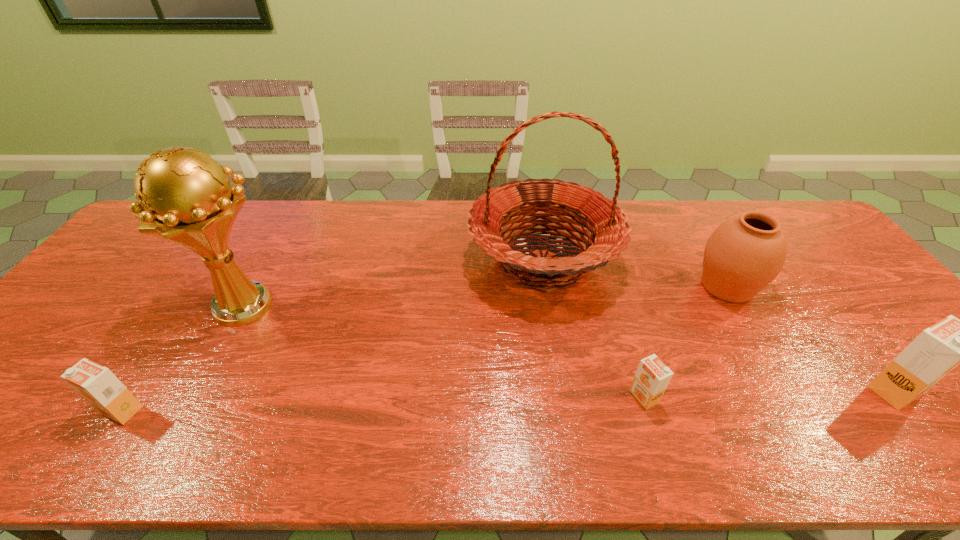
What are the coordinates of `vacant space located 0.380m on the right of the second orange juice from left to right` in the screenshot? It's located at (826, 396).

This screenshot has height=540, width=960. I want to click on free spot located on the right of the rightmost object, so click(948, 390).

The image size is (960, 540). What are the coordinates of `blank space located 0.400m at the front of the trophy_cup where the globe is prominent` in the screenshot? It's located at (435, 306).

You are a GUI agent. You are given a task and a screenshot of the screen. Output one action in this format:
    pyautogui.click(x=<x>, y=<y>)
    Task: Click on the free region located 0.300m on the left of the urn
    The height and width of the screenshot is (540, 960).
    Given the screenshot: What is the action you would take?
    pyautogui.click(x=588, y=286)

Where is `vacant area located on the right of the basket`? The image size is (960, 540). vacant area located on the right of the basket is located at coordinates (731, 260).

Locate an element on the screen. The height and width of the screenshot is (540, 960). object at the far edge is located at coordinates (607, 223).

This screenshot has width=960, height=540. I want to click on object situated at the right edge, so click(937, 350).

Where is `object at the near right corner`? The width and height of the screenshot is (960, 540). object at the near right corner is located at coordinates (937, 350).

The image size is (960, 540). What are the coordinates of `free location at the far edge` in the screenshot? It's located at (256, 220).

Image resolution: width=960 pixels, height=540 pixels. In the image, there is a desktop. Identify the location of vacant area at the near edge. (139, 413).